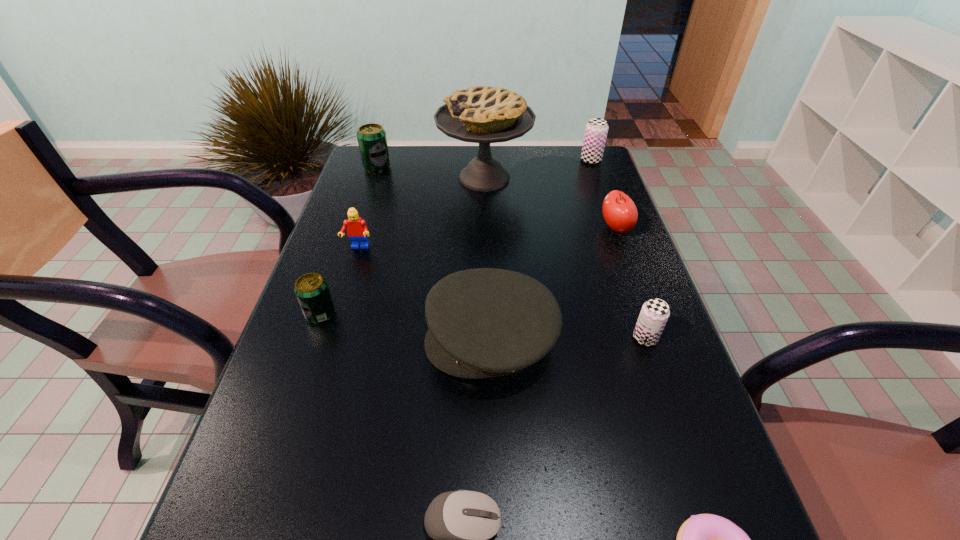
Image resolution: width=960 pixels, height=540 pixels. What are the coordinates of `the fourth closest beer can to the seventh nearest object` in the screenshot? It's located at (311, 289).

The width and height of the screenshot is (960, 540). I want to click on beer can that is the fourth nearest to the computer equipment, so click(596, 130).